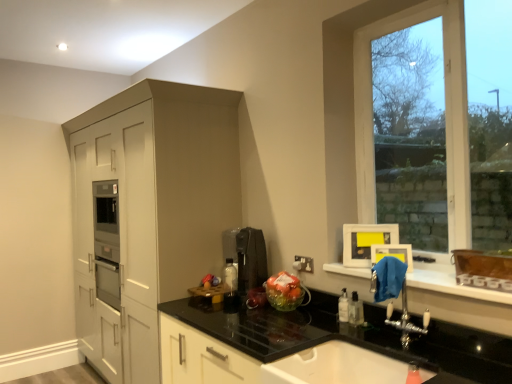
Question: Is clear plastic bottle at lower right oriented towards blue fabric at lower right?

Choices:
 (A) no
 (B) yes

Answer: (A)

Question: Can you confirm if clear plastic bottle at lower right is thinner than blue fabric at lower right?

Choices:
 (A) no
 (B) yes

Answer: (B)

Question: Does clear plastic bottle at lower right have a lesser height compared to blue fabric at lower right?

Choices:
 (A) yes
 (B) no

Answer: (B)

Question: Is clear plastic bottle at lower right at the right side of blue fabric at lower right?

Choices:
 (A) yes
 (B) no

Answer: (B)

Question: Does clear plastic bottle at lower right have a greater width compared to blue fabric at lower right?

Choices:
 (A) no
 (B) yes

Answer: (A)

Question: In terms of height, does clear plastic bottle at lower right look taller or shorter compared to matte white cabinet at left?

Choices:
 (A) tall
 (B) short

Answer: (B)

Question: In terms of size, does clear plastic bottle at lower right appear bigger or smaller than matte white cabinet at left?

Choices:
 (A) big
 (B) small

Answer: (B)

Question: Is clear plastic bottle at lower right wider or thinner than matte white cabinet at left?

Choices:
 (A) wide
 (B) thin

Answer: (B)

Question: From the image's perspective, relative to matte white cabinet at left, is clear plastic bottle at lower right above or below?

Choices:
 (A) below
 (B) above

Answer: (A)

Question: From the image's perspective, is matte white cabinet at left above or below white glossy sink at lower center?

Choices:
 (A) above
 (B) below

Answer: (A)

Question: From a real-world perspective, is matte white cabinet at left positioned above or below white glossy sink at lower center?

Choices:
 (A) above
 (B) below

Answer: (A)

Question: Based on their sizes in the image, would you say matte white cabinet at left is bigger or smaller than white glossy sink at lower center?

Choices:
 (A) big
 (B) small

Answer: (A)

Question: Considering the positions of matte white cabinet at left and white glossy sink at lower center in the image, is matte white cabinet at left wider or thinner than white glossy sink at lower center?

Choices:
 (A) thin
 (B) wide

Answer: (B)

Question: From the image's perspective, is black granite countertop at center above or below clear glass window at upper right?

Choices:
 (A) below
 (B) above

Answer: (A)

Question: Is point (287, 339) positioned closer to the camera than point (443, 6)?

Choices:
 (A) farther
 (B) closer

Answer: (B)